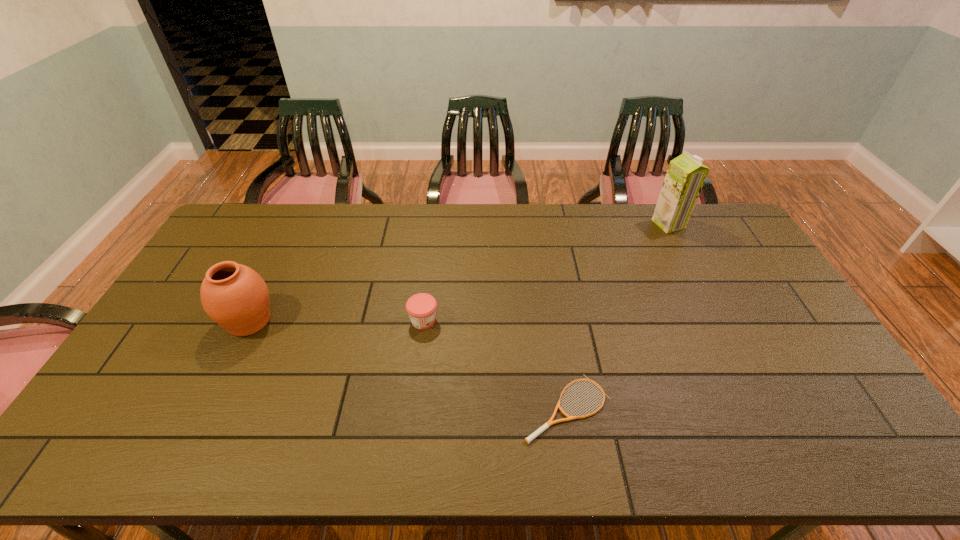
Find the location of a particular element. This screenshot has height=540, width=960. free space located on the front label of the second shortest object is located at coordinates (518, 320).

Find the location of a particular element. The width and height of the screenshot is (960, 540). free spot located on the left of the shortest object is located at coordinates (451, 408).

This screenshot has height=540, width=960. In order to click on object that is at the far edge in this screenshot , I will do `click(685, 177)`.

Where is `object that is at the near edge`? The width and height of the screenshot is (960, 540). object that is at the near edge is located at coordinates (550, 422).

At what (x,y) coordinates should I click in order to perform the action: click on vacant position at the far edge of the desktop. Please return your answer as a coordinate pair (x, y). The width and height of the screenshot is (960, 540). Looking at the image, I should click on (443, 221).

Where is `free space at the near edge of the desktop`? The height and width of the screenshot is (540, 960). free space at the near edge of the desktop is located at coordinates (608, 463).

In the image, there is a desktop. Identify the location of vacant space at the left edge. This screenshot has width=960, height=540. (245, 262).

The image size is (960, 540). In the image, there is a desktop. Find the location of `vacant space at the right edge`. vacant space at the right edge is located at coordinates (803, 361).

In the image, there is a desktop. Identify the location of vacant area at the far left corner. The height and width of the screenshot is (540, 960). (223, 239).

Image resolution: width=960 pixels, height=540 pixels. I want to click on vacant area at the far right corner of the desktop, so click(713, 239).